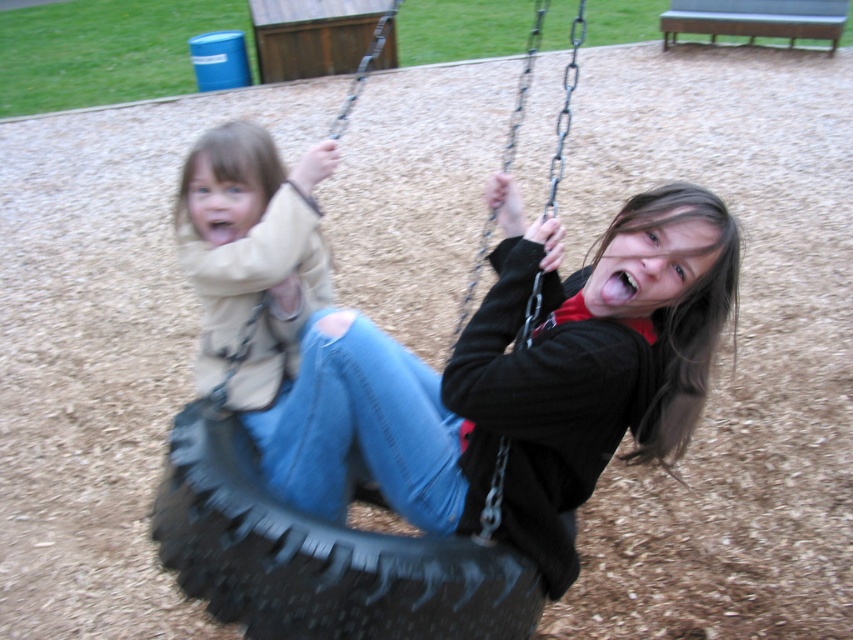
Which is behind, point (483, 348) or point (225, 236)?

The point (225, 236) is behind.

Is matte black tire swing at center further to camera compared to ripped denim jeans at left?

No, matte black tire swing at center is in front of ripped denim jeans at left.

The width and height of the screenshot is (853, 640). I want to click on matte black tire swing at center, so pos(538,378).

Is ripped denim jeans at left positioned in front of metallic chain swing at center?

No.

Which is more to the right, ripped denim jeans at left or metallic chain swing at center?

From the viewer's perspective, metallic chain swing at center appears more on the right side.

In order to click on ripped denim jeans at left in this screenshot , I will do `click(251, 256)`.

Which is more to the right, black rubber tire at center or metallic chain swing at center?

Positioned to the right is metallic chain swing at center.

Does black rubber tire at center have a greater height compared to metallic chain swing at center?

In fact, black rubber tire at center may be shorter than metallic chain swing at center.

What do you see at coordinates (318, 556) in the screenshot?
I see `black rubber tire at center` at bounding box center [318, 556].

You are a GUI agent. You are given a task and a screenshot of the screen. Output one action in this format:
    pyautogui.click(x=<x>, y=<y>)
    Task: Click on the black rubber tire at center
    Image resolution: width=853 pixels, height=640 pixels.
    Given the screenshot: What is the action you would take?
    point(318,556)